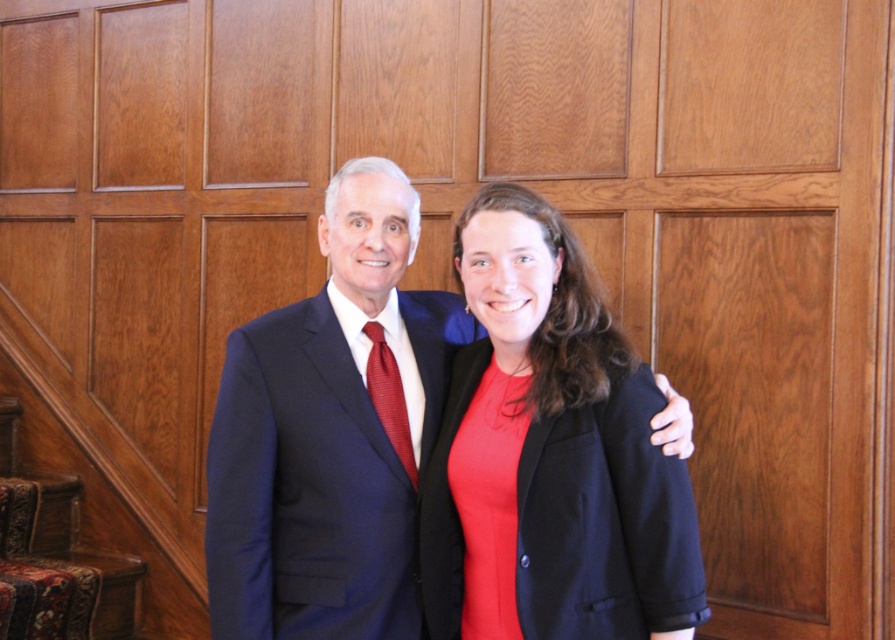
Is matte black suit at center in front of red textured tie at center?

Yes.

Image resolution: width=895 pixels, height=640 pixels. Describe the element at coordinates (331, 433) in the screenshot. I see `matte black suit at center` at that location.

Locate an element on the screen. The width and height of the screenshot is (895, 640). matte black suit at center is located at coordinates (331, 433).

Does matte black blazer at center have a lesser height compared to matte black suit at center?

Indeed, matte black blazer at center has a lesser height compared to matte black suit at center.

Can you confirm if matte black blazer at center is positioned to the left of matte black suit at center?

No, matte black blazer at center is not to the left of matte black suit at center.

Locate an element on the screen. This screenshot has width=895, height=640. matte black blazer at center is located at coordinates (550, 454).

Is matte black blazer at center taller than red textured tie at center?

Correct, matte black blazer at center is much taller as red textured tie at center.

Where is `matte black blazer at center`? matte black blazer at center is located at coordinates (550, 454).

Between point (631, 531) and point (393, 380), which one is positioned in front?

Point (631, 531) is more forward.

Where is `matte black blazer at center`? Image resolution: width=895 pixels, height=640 pixels. matte black blazer at center is located at coordinates (550, 454).